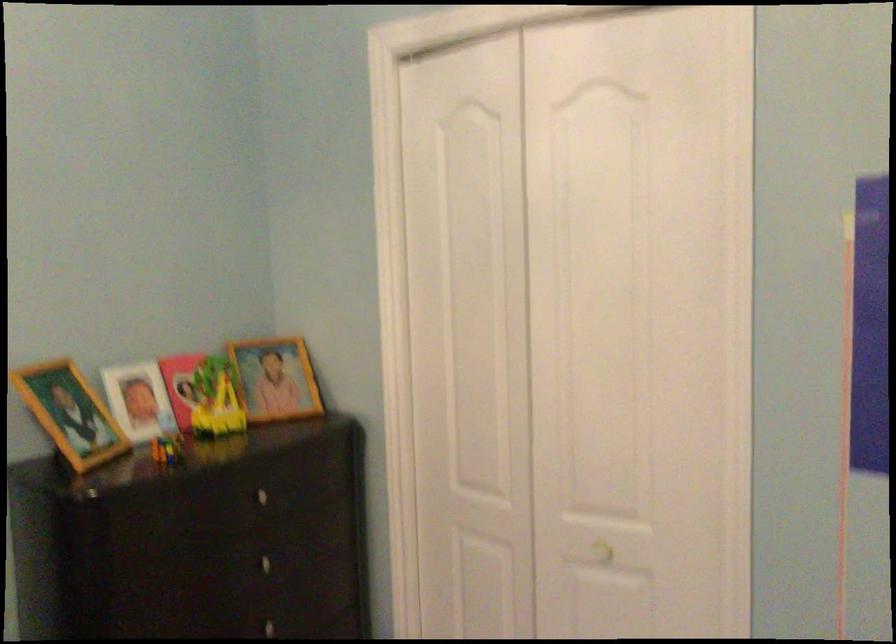
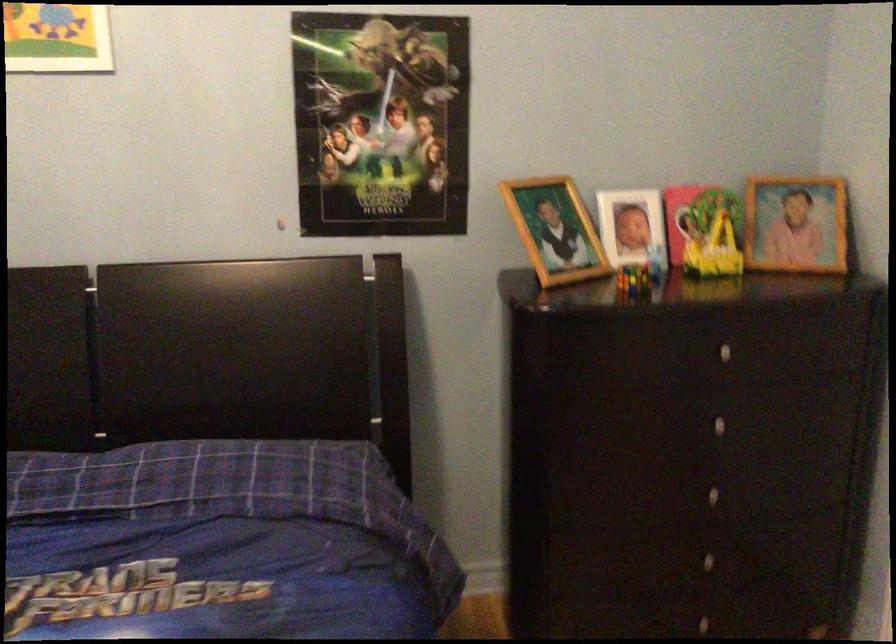
The point at (221, 401) is marked in the first image. Where is the corresponding point in the second image?

(719, 240)